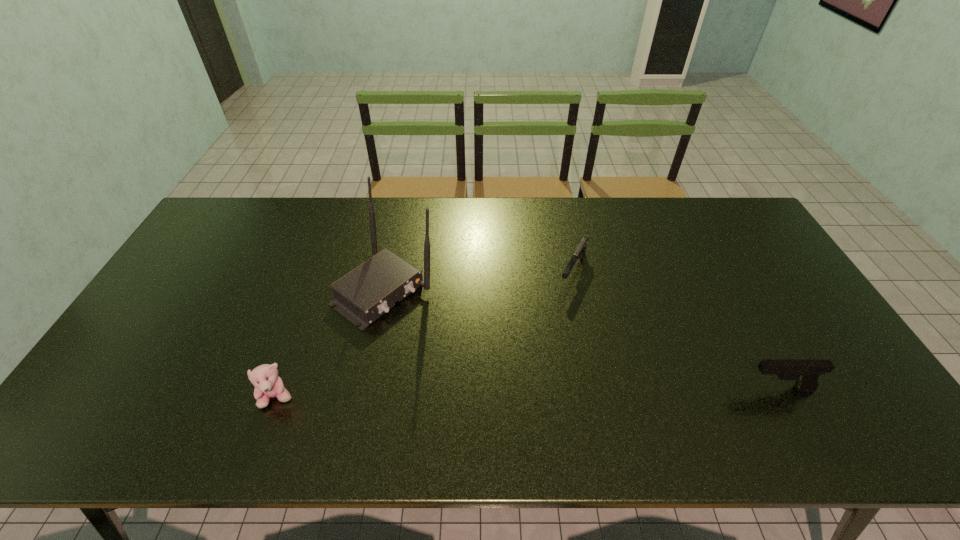
At what (x,y) coordinates should I click in order to perform the action: click on vacant space on the desktop that is between the leftmost object and the rightmost object and is positioned on the back of the router to connect cables. Please return your answer as a coordinate pair (x, y). Image resolution: width=960 pixels, height=540 pixels. Looking at the image, I should click on (532, 393).

Where is `vacant spot on the desktop that is between the teddy bear and the pistol and is positioned at the muzzle end of the second object from right to left`? This screenshot has height=540, width=960. vacant spot on the desktop that is between the teddy bear and the pistol and is positioned at the muzzle end of the second object from right to left is located at coordinates click(507, 394).